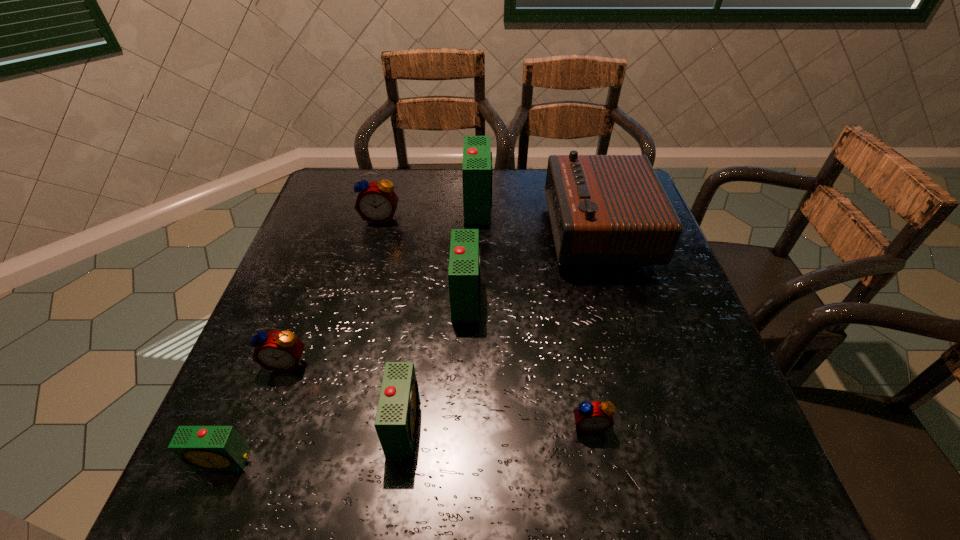
Locate an element on the screen. free space between the smallest green alarm clock and the brown radio receiver is located at coordinates (411, 346).

This screenshot has width=960, height=540. Find the location of `vacant space that's between the third object from left to right and the second biggest green alarm clock`. vacant space that's between the third object from left to right and the second biggest green alarm clock is located at coordinates (423, 257).

Image resolution: width=960 pixels, height=540 pixels. In order to click on vacant area that lies between the third object from left to right and the rightmost red alarm clock in this screenshot , I will do `click(485, 321)`.

Locate which object is the fifth closest to the second farthest green alarm clock. Please provide its 2D coordinates. Your answer should be formatted as a tuple, i.e. [(x, y)], where the tuple contains the x and y coordinates of a point satisfying the conditions above.

[(591, 417)]

Where is `object that ranks as the fourth closest to the second smallest green alarm clock`? object that ranks as the fourth closest to the second smallest green alarm clock is located at coordinates (591, 417).

What are the coordinates of `alarm clock that is the fourth closest to the third farthest alarm clock` in the screenshot? It's located at (591, 417).

Locate an element on the screen. The height and width of the screenshot is (540, 960). alarm clock object that ranks as the fifth closest to the third green alarm clock from right to left is located at coordinates (376, 202).

Locate an element on the screen. The image size is (960, 540). green alarm clock that is the closest to the farthest green alarm clock is located at coordinates point(464,260).

Choose which green alarm clock is the third nearest neighbor to the fifth alarm clock from right to left. Please provide its 2D coordinates. Your answer should be formatted as a tuple, i.e. [(x, y)], where the tuple contains the x and y coordinates of a point satisfying the conditions above.

[(396, 421)]

Locate which red alarm clock is the third closest to the brown radio receiver. Please provide its 2D coordinates. Your answer should be formatted as a tuple, i.e. [(x, y)], where the tuple contains the x and y coordinates of a point satisfying the conditions above.

[(281, 351)]